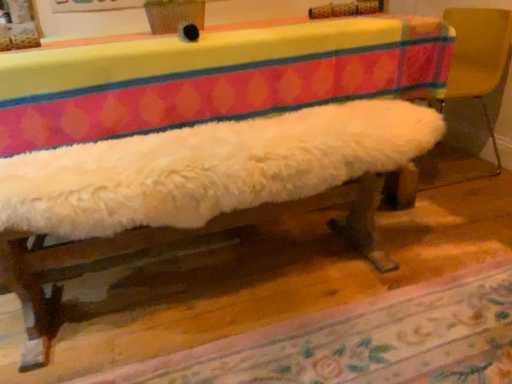
Question: Is the surface of floral carpet at lower center in direct contact with white fluffy cushion at right?

Choices:
 (A) yes
 (B) no

Answer: (B)

Question: Is floral carpet at lower center turned away from white fluffy cushion at right?

Choices:
 (A) no
 (B) yes

Answer: (A)

Question: Is floral carpet at lower center outside of white fluffy cushion at right?

Choices:
 (A) yes
 (B) no

Answer: (A)

Question: Does floral carpet at lower center appear on the left side of white fluffy cushion at right?

Choices:
 (A) no
 (B) yes

Answer: (B)

Question: From the image's perspective, is floral carpet at lower center located above white fluffy cushion at right?

Choices:
 (A) no
 (B) yes

Answer: (A)

Question: Considering the relative sizes of floral carpet at lower center and white fluffy cushion at right in the image provided, is floral carpet at lower center bigger than white fluffy cushion at right?

Choices:
 (A) no
 (B) yes

Answer: (A)

Question: Is white fluffy cushion at right wider than floral carpet at lower center?

Choices:
 (A) yes
 (B) no

Answer: (B)

Question: Considering the relative sizes of white fluffy cushion at right and floral carpet at lower center in the image provided, is white fluffy cushion at right shorter than floral carpet at lower center?

Choices:
 (A) no
 (B) yes

Answer: (A)

Question: From the image's perspective, is white fluffy cushion at right above floral carpet at lower center?

Choices:
 (A) no
 (B) yes

Answer: (B)

Question: Is white fluffy cushion at right positioned beyond the bounds of floral carpet at lower center?

Choices:
 (A) yes
 (B) no

Answer: (A)

Question: Is white fluffy cushion at right behind floral carpet at lower center?

Choices:
 (A) yes
 (B) no

Answer: (A)

Question: Is white fluffy cushion at right at the left side of floral carpet at lower center?

Choices:
 (A) no
 (B) yes

Answer: (A)

Question: Is white fluffy cushion at right taller or shorter than floral carpet at lower center?

Choices:
 (A) tall
 (B) short

Answer: (A)